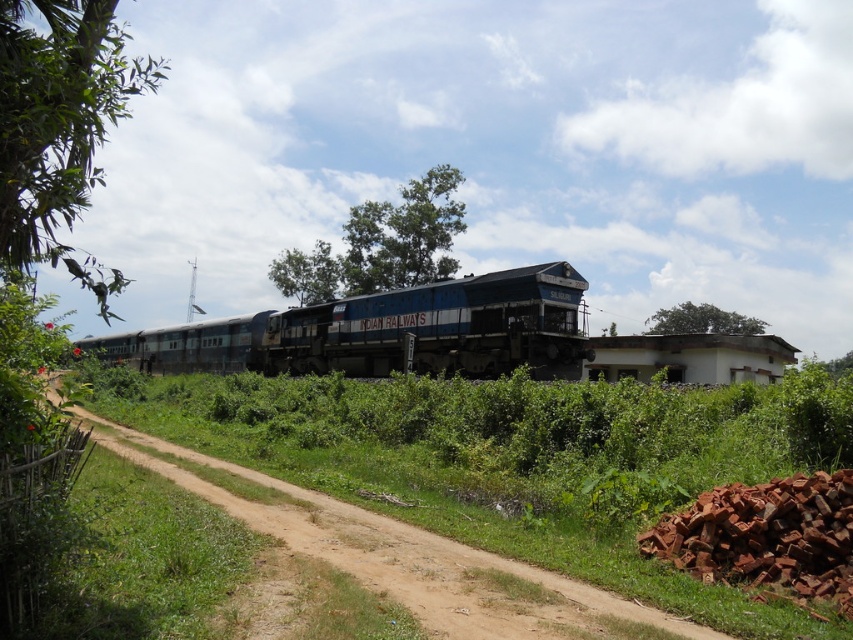
Does blue painted steel train at center appear over green leafy tree at upper center?

Incorrect, blue painted steel train at center is not positioned above green leafy tree at upper center.

Can you confirm if blue painted steel train at center is wider than green leafy tree at upper center?

Correct, the width of blue painted steel train at center exceeds that of green leafy tree at upper center.

Does point (229, 348) come farther from viewer compared to point (664, 314)?

No.

Where is `blue painted steel train at center`? The width and height of the screenshot is (853, 640). blue painted steel train at center is located at coordinates (386, 332).

Which is more to the left, green leafy tree at upper left or green leafy tree at upper center?

green leafy tree at upper left is more to the left.

Does green leafy tree at upper left have a greater height compared to green leafy tree at upper center?

Indeed, green leafy tree at upper left has a greater height compared to green leafy tree at upper center.

The height and width of the screenshot is (640, 853). Describe the element at coordinates (59, 124) in the screenshot. I see `green leafy tree at upper left` at that location.

Where is `green leafy tree at upper left`? green leafy tree at upper left is located at coordinates (59, 124).

What are the coordinates of `brown dirt track at center` in the screenshot? It's located at (392, 552).

Consider the image. Is brown dirt track at center shorter than green leafy tree at upper left?

Yes, brown dirt track at center is shorter than green leafy tree at upper left.

Identify the location of brown dirt track at center. (392, 552).

Image resolution: width=853 pixels, height=640 pixels. Identify the location of brown dirt track at center. (392, 552).